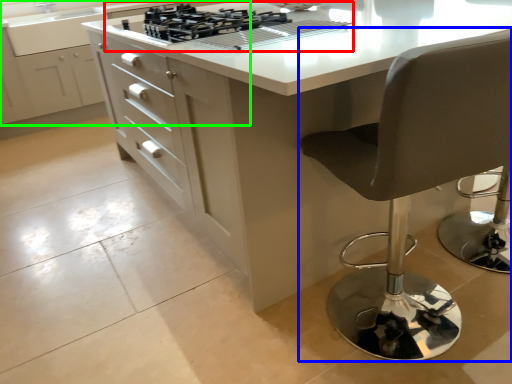
Question: Which object is the closest to the gas stove (highlighted by a red box)? Choose among these: chair (highlighted by a blue box) or cabinetry (highlighted by a green box).

Choices:
 (A) chair
 (B) cabinetry

Answer: (A)